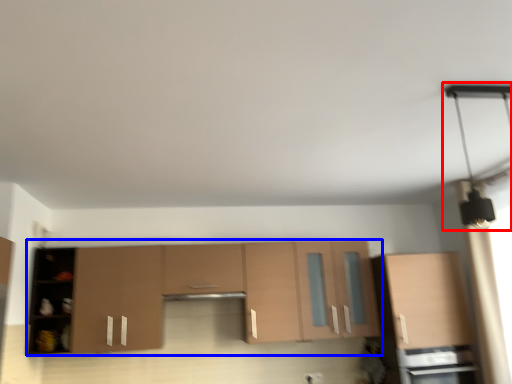
Question: Among these objects, which one is nearest to the camera, light fixture (highlighted by a red box) or cabinetry (highlighted by a blue box)?

Choices:
 (A) light fixture
 (B) cabinetry

Answer: (A)